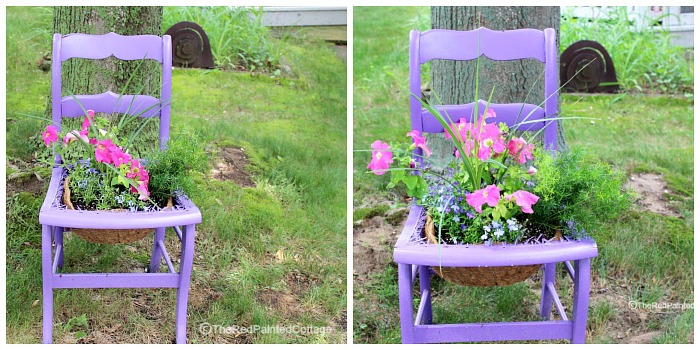
Find the location of a particular element. This screenshot has width=700, height=350. chair back is located at coordinates (134, 44), (433, 39).